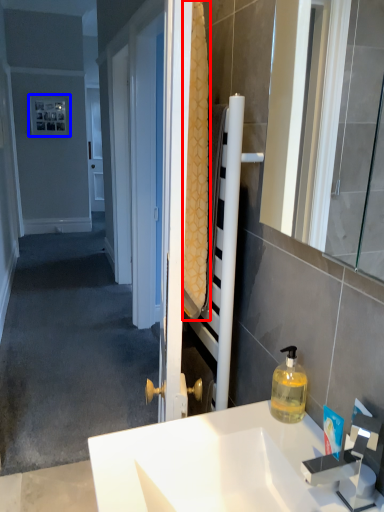
Question: Among these objects, which one is nearest to the camera, bath towel (highlighted by a red box) or picture frame (highlighted by a blue box)?

Choices:
 (A) bath towel
 (B) picture frame

Answer: (A)